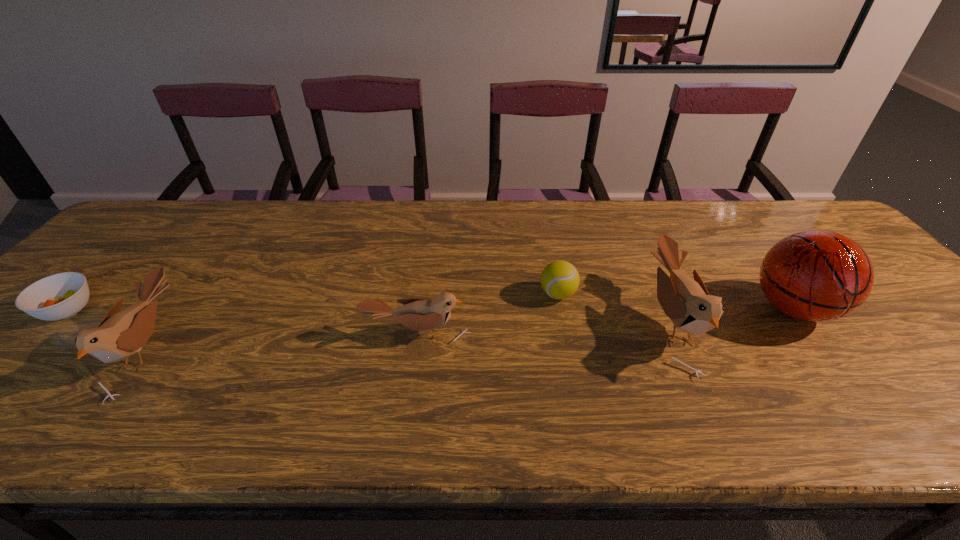
The width and height of the screenshot is (960, 540). Identify the location of free space located on the right of the soup bowl. (156, 310).

What are the coordinates of `object that is at the left edge` in the screenshot? It's located at (59, 296).

This screenshot has height=540, width=960. In order to click on vacant space at the far edge of the desktop in this screenshot , I will do click(637, 219).

The image size is (960, 540). I want to click on free location at the near edge of the desktop, so [x=910, y=395].

Locate an element on the screen. Image resolution: width=960 pixels, height=540 pixels. vacant space at the left edge of the desktop is located at coordinates (50, 326).

In the image, there is a desktop. In order to click on vacant space at the far left corner in this screenshot , I will do `click(160, 231)`.

At what (x,y) coordinates should I click in order to perform the action: click on vacant space at the far right corner of the desktop. Please return your answer as a coordinate pair (x, y). Looking at the image, I should click on (780, 205).

At what (x,y) coordinates should I click in order to perform the action: click on free space at the near right corner of the desktop. Please return your answer as a coordinate pair (x, y). Image resolution: width=960 pixels, height=540 pixels. Looking at the image, I should click on tap(919, 373).

Locate an element on the screen. The width and height of the screenshot is (960, 540). vacant space that's between the rightmost bird and the fourth shortest object is located at coordinates (409, 335).

This screenshot has width=960, height=540. In order to click on vacant area that lies between the third shortest object and the second object from right to left in this screenshot , I will do `click(544, 328)`.